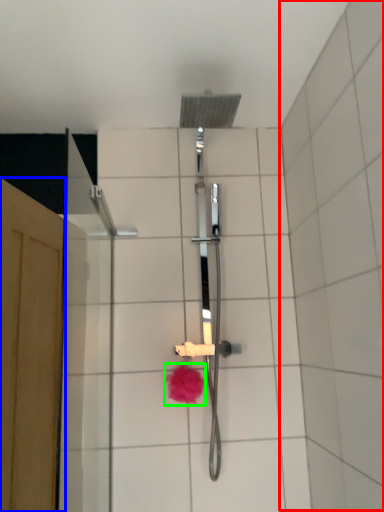
Question: Which is farther away from ceramic tile (highlighted by a red box)? screen door (highlighted by a blue box) or flower (highlighted by a green box)?

Choices:
 (A) screen door
 (B) flower

Answer: (A)